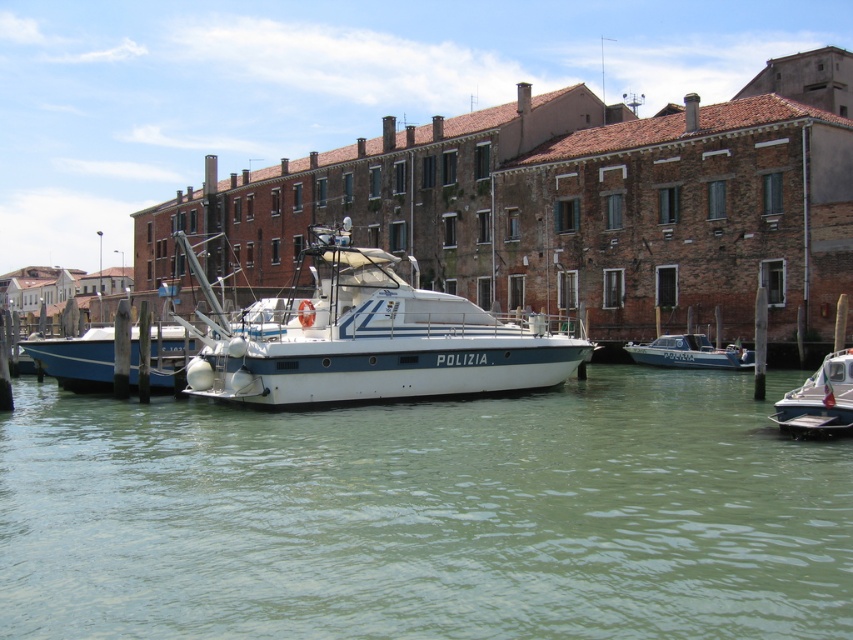
Between white plastic boat at lower right and metallic blue police boat at center, which one appears on the left side from the viewer's perspective?

From the viewer's perspective, white plastic boat at lower right appears more on the left side.

Can you confirm if white plastic boat at lower right is positioned to the right of metallic blue police boat at center?

Incorrect, white plastic boat at lower right is not on the right side of metallic blue police boat at center.

Describe the element at coordinates (819, 401) in the screenshot. I see `white plastic boat at lower right` at that location.

Identify the location of white plastic boat at lower right. (819, 401).

Looking at this image, is green water at center behind white plastic boat at lower right?

No, it is not.

Who is positioned more to the left, green water at center or white plastic boat at lower right?

green water at center is more to the left.

Is point (378, 420) closer to camera compared to point (825, 376)?

That is False.

You are a GUI agent. You are given a task and a screenshot of the screen. Output one action in this format:
    pyautogui.click(x=<x>, y=<y>)
    Task: Click on the green water at center
    This screenshot has height=640, width=853.
    Given the screenshot: What is the action you would take?
    pyautogui.click(x=425, y=516)

Is white glossy boat at center to the right of white plastic boat at lower right from the viewer's perspective?

Incorrect, white glossy boat at center is not on the right side of white plastic boat at lower right.

Between point (224, 396) and point (846, 385), which one is positioned behind?

Point (224, 396)

What are the coordinates of `white glossy boat at center` in the screenshot? It's located at (367, 339).